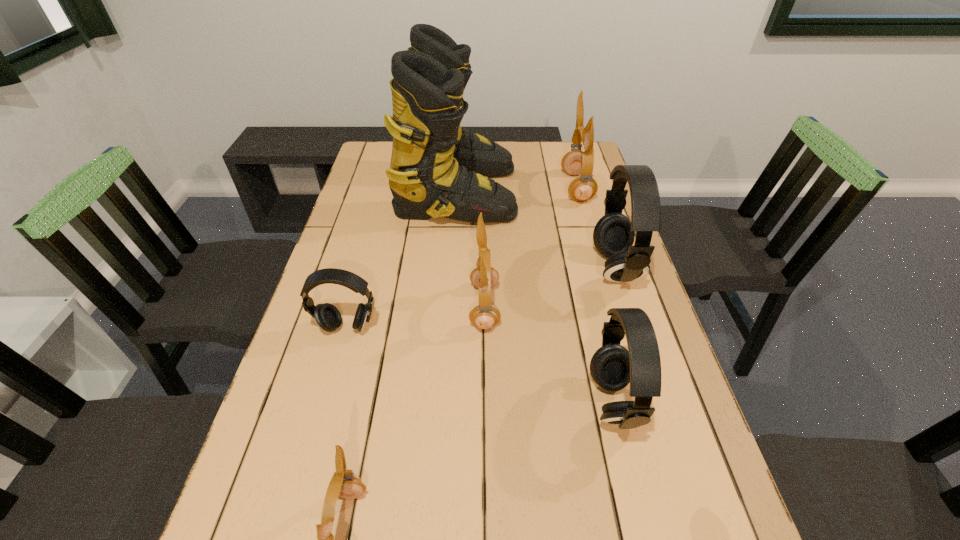
I want to click on vacant space situated 0.250m on the ear cups of the fifth farthest earphone, so click(x=472, y=402).

Identify the location of free space located on the ear cups of the fifth farthest earphone. The width and height of the screenshot is (960, 540). (401, 402).

The image size is (960, 540). Identify the location of vacant area situated on the ear cups of the fifth farthest earphone. (495, 402).

Locate an element on the screen. free region located 0.300m on the ear cups of the leftmost black earphone is located at coordinates (308, 464).

The image size is (960, 540). In order to click on ski boots located at the far edge in this screenshot , I will do `click(437, 168)`.

The image size is (960, 540). In order to click on earphone at the far edge in this screenshot , I will do `click(583, 188)`.

You are a GUI agent. You are given a task and a screenshot of the screen. Output one action in this format:
    pyautogui.click(x=<x>, y=<y>)
    Task: Click on the ski boots present at the left edge
    The height and width of the screenshot is (540, 960).
    Given the screenshot: What is the action you would take?
    pyautogui.click(x=437, y=168)

At what (x,y) coordinates should I click in order to perform the action: click on earphone that is at the left edge. Please return your answer as a coordinate pair (x, y). The width and height of the screenshot is (960, 540). Looking at the image, I should click on (327, 316).

Identify the location of object that is at the far left corner. (437, 168).

Where is `object present at the far right corner`? Image resolution: width=960 pixels, height=540 pixels. object present at the far right corner is located at coordinates (583, 188).